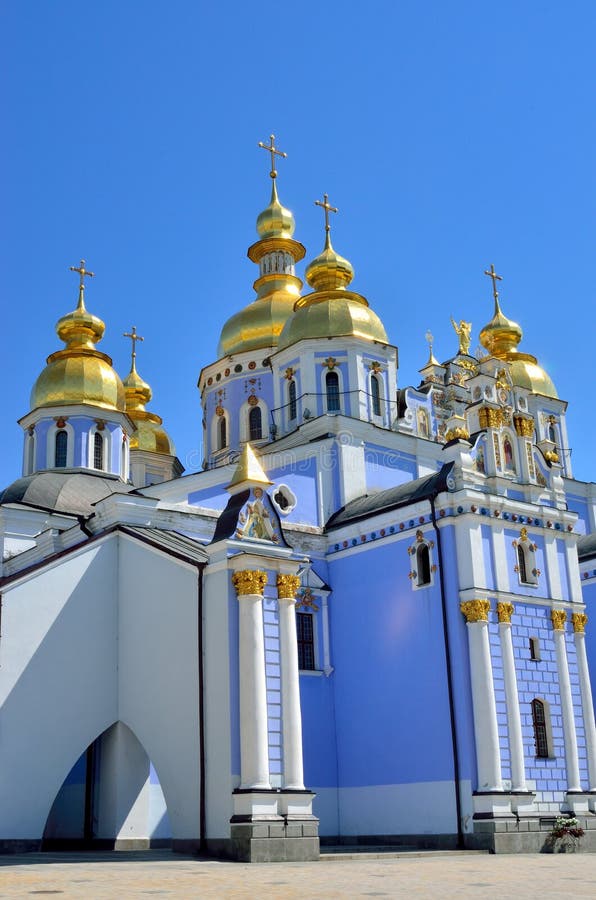
Find the location of a particular element. brick walls is located at coordinates (537, 678), (275, 691).